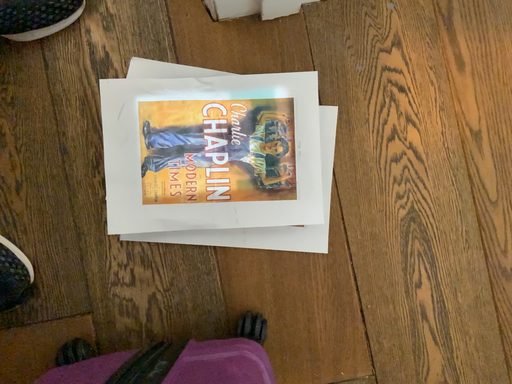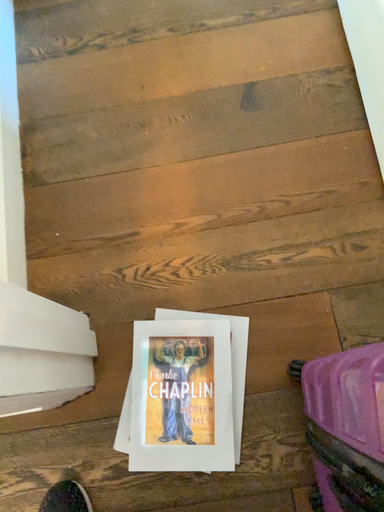
Question: How did the camera likely rotate when shooting the video?

Choices:
 (A) rotated downward
 (B) rotated upward

Answer: (B)